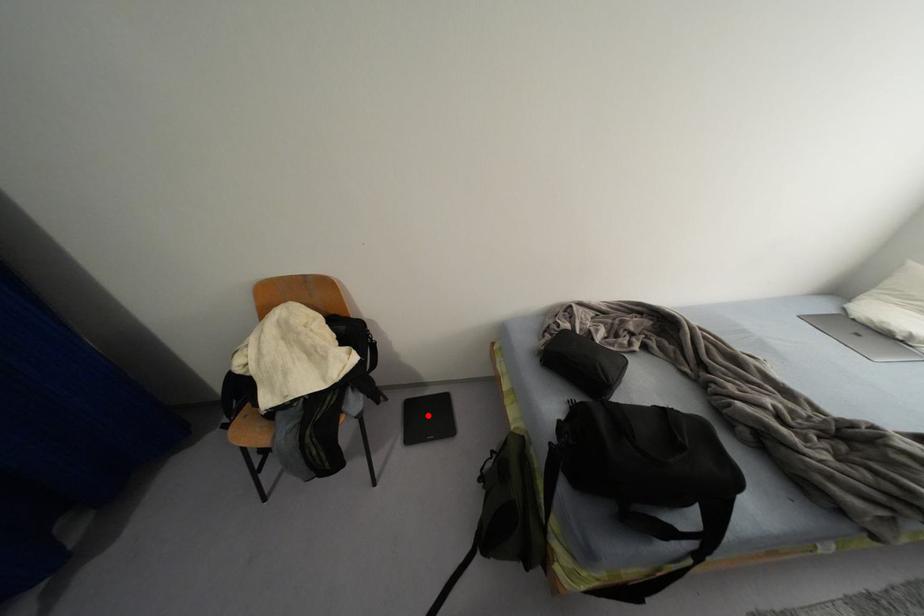
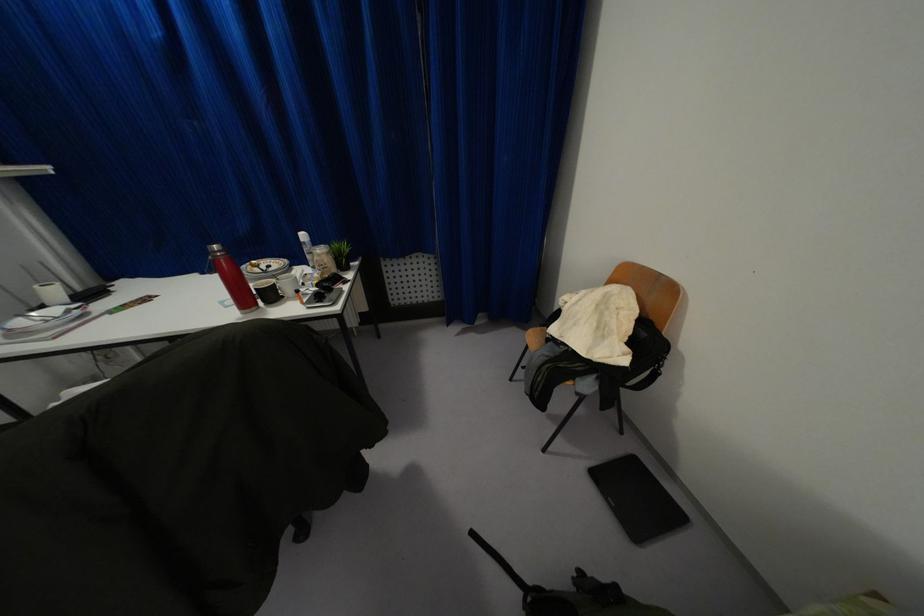
Where in the second image is the point corresponding to the highlighted location from the first image?

(636, 493)